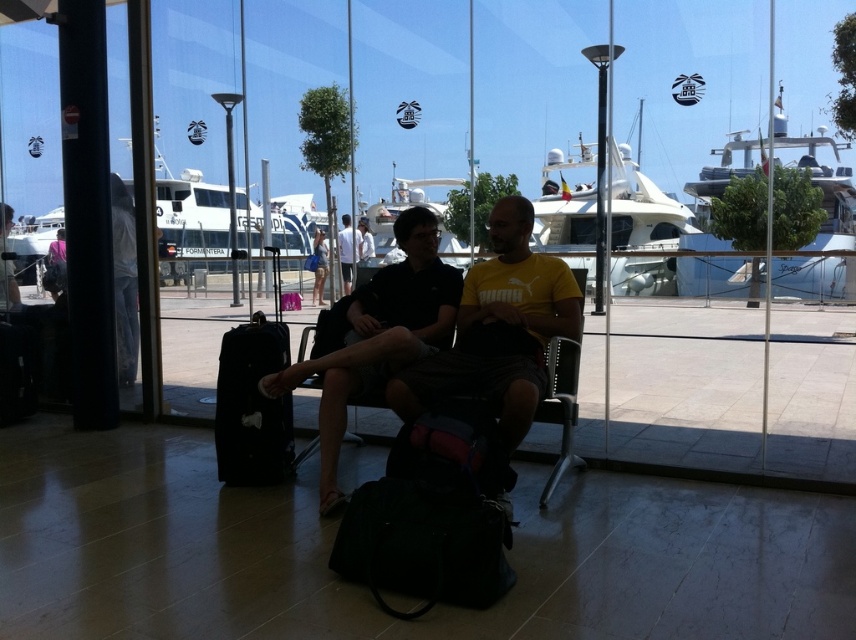
Is matte black shirt at center further to the viewer compared to dark blue shirt at center?

That is False.

Who is positioned more to the left, matte black shirt at center or dark blue shirt at center?

Positioned to the left is dark blue shirt at center.

Which is in front, point (553, 280) or point (321, 252)?

Positioned in front is point (553, 280).

This screenshot has height=640, width=856. I want to click on matte black shirt at center, so click(456, 346).

Does matte black shirt at center have a smaller size compared to black fabric suitcase at left?

No.

Does matte black shirt at center appear over black fabric suitcase at left?

Yes.

This screenshot has height=640, width=856. Describe the element at coordinates (456, 346) in the screenshot. I see `matte black shirt at center` at that location.

The width and height of the screenshot is (856, 640). Find the location of `matte black shirt at center`. matte black shirt at center is located at coordinates (456, 346).

Can you confirm if black fabric suitcase at left is thinner than yellow cotton t-shirt at center?

No, black fabric suitcase at left is not thinner than yellow cotton t-shirt at center.

Is black fabric suitcase at left positioned in front of yellow cotton t-shirt at center?

Yes, black fabric suitcase at left is closer to the viewer.

Identify the location of black fabric suitcase at left. The height and width of the screenshot is (640, 856). (253, 401).